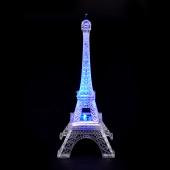
Identify the location of gray beams. (64, 131), (68, 142), (103, 144), (107, 133).